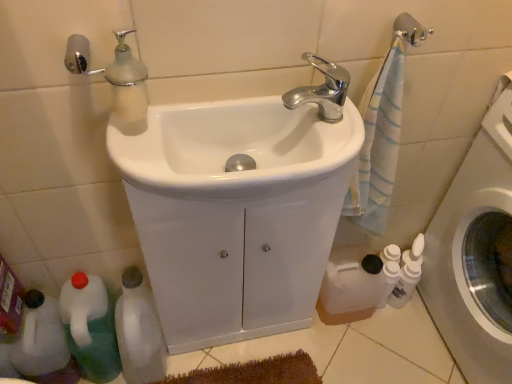
Question: Would you say white plastic bottle at lower left is to the left or to the right of white plastic bottle at lower left, the 3th bottle in the right-to-left sequence, in the picture?

Choices:
 (A) right
 (B) left

Answer: (B)

Question: From a real-world perspective, is white plastic bottle at lower left above or below white plastic bottle at lower left, the 1th bottle viewed from the left?

Choices:
 (A) above
 (B) below

Answer: (B)

Question: Which of these objects is positioned closest to the white plastic bottle at lower left?

Choices:
 (A) silver metallic towel bar at upper right
 (B) white glossy bottle at lower left, which is the 2th bottle from left to right
 (C) white glossy bottles at lower right
 (D) white plastic washing machine at right
 (E) white matte bottle at lower right, acting as the first bottle starting from the right

Answer: (B)

Question: Which object is the closest to the white glossy bottle at lower left, which is counted as the 2th bottle, starting from the right?

Choices:
 (A) white glossy bottles at lower right
 (B) white glossy sink at center, positioned as the second sink in front-to-back order
 (C) chrome metallic faucet at upper center
 (D) silver metallic towel bar at upper right
 (E) white plastic bottle at lower left

Answer: (E)